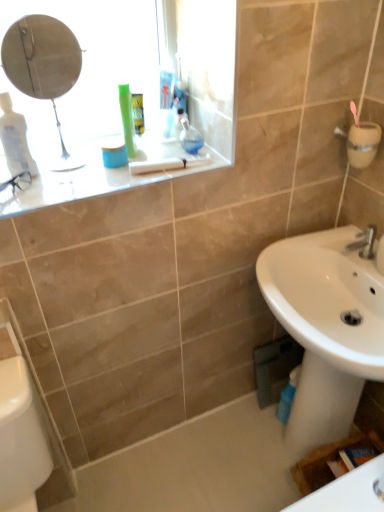
You are a GUI agent. You are given a task and a screenshot of the screen. Output one action in this format:
    pyautogui.click(x=<x>, y=<y>)
    Task: Click on the white glossy porcelain at lower left
    
    Given the screenshot: What is the action you would take?
    pyautogui.click(x=20, y=437)

The width and height of the screenshot is (384, 512). Describe the element at coordinates (20, 437) in the screenshot. I see `white glossy porcelain at lower left` at that location.

You are a GUI agent. You are given a task and a screenshot of the screen. Output one action in this format:
    pyautogui.click(x=<x>, y=<y>)
    Task: Click on the white glossy bath at lower center
    
    Given the screenshot: What is the action you would take?
    pyautogui.click(x=196, y=467)

The width and height of the screenshot is (384, 512). Find the location of `white glossy porcelain at lower left`. white glossy porcelain at lower left is located at coordinates (20, 437).

Is white glossy counter top at upper left bigger or smaller than white glossy sink at lower right?

white glossy counter top at upper left is smaller than white glossy sink at lower right.

How different are the orientations of white glossy counter top at upper left and white glossy sink at lower right in degrees?

The angle between the facing direction of white glossy counter top at upper left and the facing direction of white glossy sink at lower right is 90.1 degrees.

Can you see white glossy counter top at upper left touching white glossy sink at lower right?

No, white glossy counter top at upper left is not beside white glossy sink at lower right.

Is white glossy sink at lower right at the left side of white glossy porcelain at lower left?

No, white glossy sink at lower right is not to the left of white glossy porcelain at lower left.

Based on the photo, from a real-world perspective, who is located higher, white glossy sink at lower right or white glossy porcelain at lower left?

white glossy sink at lower right.

Measure the distance between white glossy sink at lower right and white glossy porcelain at lower left.

32.38 inches.

How many degrees apart are the facing directions of white glossy sink at lower right and white glossy porcelain at lower left?

The angular difference between white glossy sink at lower right and white glossy porcelain at lower left is 90.4 degrees.

Who is smaller, silver metallic faucet at lower right or white glossy counter top at upper left?

Smaller between the two is silver metallic faucet at lower right.

In the image, is silver metallic faucet at lower right on the left side or the right side of white glossy counter top at upper left?

In the image, silver metallic faucet at lower right appears on the right side of white glossy counter top at upper left.

In terms of height, does silver metallic faucet at lower right look taller or shorter compared to white glossy counter top at upper left?

Clearly, silver metallic faucet at lower right is taller compared to white glossy counter top at upper left.

Is silver metallic faucet at lower right placed right next to white glossy counter top at upper left?

silver metallic faucet at lower right is not next to white glossy counter top at upper left, and they're not touching.

Could you tell me if white glossy porcelain at lower left is turned towards silver metallic faucet at lower right?

No, white glossy porcelain at lower left is not aimed at silver metallic faucet at lower right.

Between white glossy porcelain at lower left and silver metallic faucet at lower right, which one has smaller width?

silver metallic faucet at lower right is thinner.

Where is `tap on the right of white glossy porcelain at lower left`? tap on the right of white glossy porcelain at lower left is located at coordinates (364, 242).

How different are the orientations of white glossy porcelain at lower left and silver metallic faucet at lower right in degrees?

The facing directions of white glossy porcelain at lower left and silver metallic faucet at lower right are 90.4 degrees apart.

Based on the photo, is silver metallic faucet at lower right in front of white glossy bath at lower center?

Yes, silver metallic faucet at lower right is closer to the camera.

Does point (353, 246) come behind point (236, 483)?

No.

Is silver metallic faucet at lower right beside white glossy bath at lower center?

silver metallic faucet at lower right and white glossy bath at lower center are not in contact.

Looking at this image, considering the sizes of silver metallic faucet at lower right and white glossy bath at lower center in the image, is silver metallic faucet at lower right bigger or smaller than white glossy bath at lower center?

Considering their sizes, silver metallic faucet at lower right takes up less space than white glossy bath at lower center.

The width and height of the screenshot is (384, 512). Find the location of `bath beneath the white glossy counter top at upper left (from a real-world perspective)`. bath beneath the white glossy counter top at upper left (from a real-world perspective) is located at coordinates point(196,467).

Based on the photo, how many degrees apart are the facing directions of white glossy counter top at upper left and white glossy bath at lower center?

The angle between the facing direction of white glossy counter top at upper left and the facing direction of white glossy bath at lower center is 0.000597 degrees.

Based on their sizes in the image, would you say white glossy counter top at upper left is bigger or smaller than white glossy bath at lower center?

In the image, white glossy counter top at upper left appears to be smaller than white glossy bath at lower center.

From a real-world perspective, is white glossy counter top at upper left under white glossy porcelain at lower left?

No, from a real-world perspective, white glossy counter top at upper left is not beneath white glossy porcelain at lower left.

Does white glossy counter top at upper left lie in front of white glossy porcelain at lower left?

No, white glossy counter top at upper left is behind white glossy porcelain at lower left.

Who is bigger, white glossy counter top at upper left or white glossy porcelain at lower left?

With larger size is white glossy porcelain at lower left.

Is white glossy counter top at upper left far away from white glossy porcelain at lower left?

No, white glossy counter top at upper left is in close proximity to white glossy porcelain at lower left.

The height and width of the screenshot is (512, 384). I want to click on sink located in front of the white glossy counter top at upper left, so click(325, 329).

The height and width of the screenshot is (512, 384). What are the coordinates of `porcelain below the white glossy sink at lower right (from the image's perspective)` in the screenshot? It's located at (20, 437).

When comparing their distances from white glossy sink at lower right, does white glossy porcelain at lower left or white glossy bath at lower center seem further?

Based on the image, white glossy porcelain at lower left appears to be further to white glossy sink at lower right.

Which object lies nearer to the anchor point white glossy bath at lower center, silver metallic faucet at lower right or white glossy porcelain at lower left?

white glossy porcelain at lower left is closer to white glossy bath at lower center.

Looking at the image, which one is located closer to white glossy sink at lower right, silver metallic faucet at lower right or white glossy porcelain at lower left?

silver metallic faucet at lower right is closer to white glossy sink at lower right.

From the picture: Looking at the image, which one is located closer to silver metallic faucet at lower right, white glossy sink at lower right or white glossy porcelain at lower left?

white glossy sink at lower right.

Considering their positions, is white glossy counter top at upper left positioned closer to white glossy sink at lower right than silver metallic faucet at lower right?

The object closer to white glossy sink at lower right is silver metallic faucet at lower right.

Considering their positions, is white glossy sink at lower right positioned further to white glossy porcelain at lower left than white glossy bath at lower center?

Based on the image, white glossy sink at lower right appears to be further to white glossy porcelain at lower left.

Estimate the real-world distances between objects in this image. Which object is closer to white glossy bath at lower center, silver metallic faucet at lower right or white glossy sink at lower right?

Among the two, white glossy sink at lower right is located nearer to white glossy bath at lower center.

In the scene shown: When comparing their distances from white glossy porcelain at lower left, does white glossy sink at lower right or white glossy counter top at upper left seem closer?

white glossy counter top at upper left is positioned closer to the anchor white glossy porcelain at lower left.

Identify the location of sink between silver metallic faucet at lower right and white glossy bath at lower center in the vertical direction. (325, 329).

Image resolution: width=384 pixels, height=512 pixels. I want to click on sink between white glossy counter top at upper left and white glossy bath at lower center in the up-down direction, so click(325, 329).

The height and width of the screenshot is (512, 384). I want to click on tap between white glossy counter top at upper left and white glossy bath at lower center in the up-down direction, so click(364, 242).

At what (x,y) coordinates should I click in order to perform the action: click on porcelain between white glossy counter top at upper left and white glossy bath at lower center vertically. Please return your answer as a coordinate pair (x, y). The image size is (384, 512). Looking at the image, I should click on (20, 437).